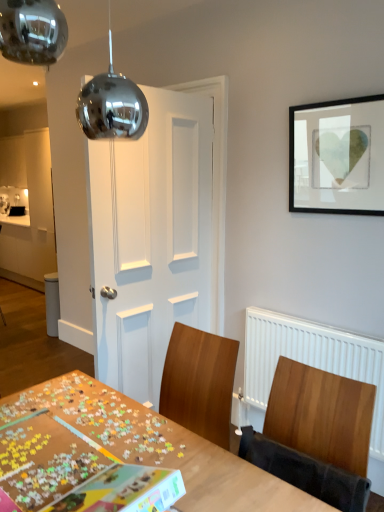
Question: Is wooden chair at right to the left or to the right of white matte door at center in the image?

Choices:
 (A) right
 (B) left

Answer: (A)

Question: From a real-world perspective, is wooden chair at right positioned above or below white matte door at center?

Choices:
 (A) below
 (B) above

Answer: (A)

Question: Considering the real-world distances, which object is closest to the wooden puzzle board at center?

Choices:
 (A) black matte picture frame at upper right
 (B) white matte door at center
 (C) wooden chair at right

Answer: (C)

Question: Which object is the closest to the white matte door at center?

Choices:
 (A) black matte picture frame at upper right
 (B) wooden chair at right
 (C) wooden puzzle board at center

Answer: (A)